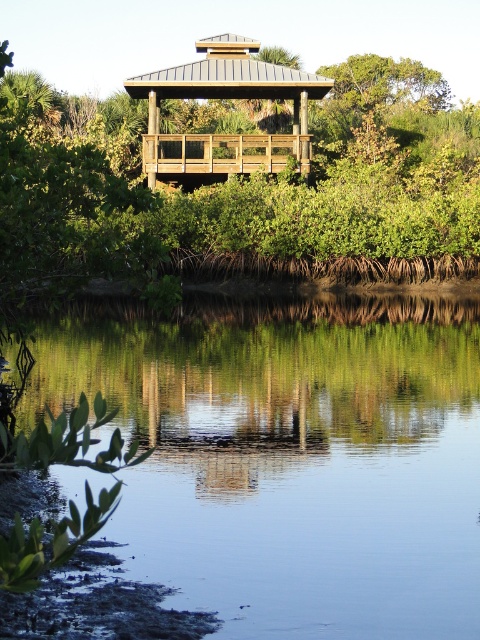
Is clear water at lower center shorter than green wood gazebo at upper center?

Correct, clear water at lower center is not as tall as green wood gazebo at upper center.

Can you confirm if clear water at lower center is thinner than green wood gazebo at upper center?

Correct, clear water at lower center's width is less than green wood gazebo at upper center's.

This screenshot has width=480, height=640. Find the location of `clear water at lower center`. clear water at lower center is located at coordinates (289, 454).

What are the coordinates of `clear water at lower center` in the screenshot? It's located at (289, 454).

Can you confirm if clear water at lower center is taller than wooden gazebo at center?

In fact, clear water at lower center may be shorter than wooden gazebo at center.

Does clear water at lower center appear on the right side of wooden gazebo at center?

Indeed, clear water at lower center is positioned on the right side of wooden gazebo at center.

This screenshot has height=640, width=480. Describe the element at coordinates (289, 454) in the screenshot. I see `clear water at lower center` at that location.

I want to click on clear water at lower center, so click(289, 454).

Is green wood gazebo at upper center to the left of wooden gazebo at center from the viewer's perspective?

Yes, green wood gazebo at upper center is to the left of wooden gazebo at center.

Does point (214, 122) come behind point (307, 148)?

That is True.

Where is `green wood gazebo at upper center`? This screenshot has height=640, width=480. green wood gazebo at upper center is located at coordinates (241, 188).